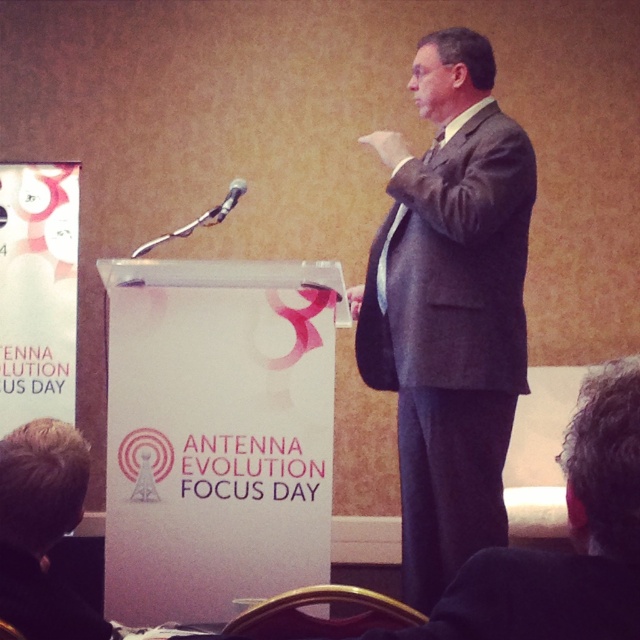
You are standing in front of the podium where the man is speaking. There are two points marked on the podium at coordinates point (445, 307) and point (205, 225). Which point is closer to you?

Point (445, 307) is closer to the camera than point (205, 225), so the point closer to you is point (445, 307).

You are an event coordinator setting up for a presentation. You need to ensure the speaker can reach the microphone easily. Based on the scene, is the matte gray suit at center positioned in a way that allows the speaker to comfortably reach the black plastic microphone at upper center?

The matte gray suit at center is in front of the black plastic microphone at upper center, meaning the speaker is positioned close enough to comfortably reach the microphone without straining.